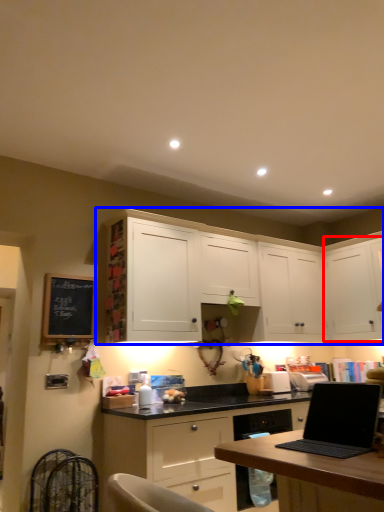
Question: Which of the following is the closest to the observer, cabinetry (highlighted by a red box) or cabinetry (highlighted by a blue box)?

Choices:
 (A) cabinetry
 (B) cabinetry

Answer: (B)